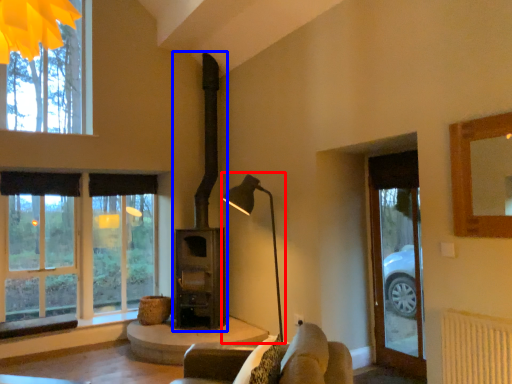
Question: Which object is closer to the camera taking this photo, table lamp (highlighted by a red box) or fireplace (highlighted by a blue box)?

Choices:
 (A) table lamp
 (B) fireplace

Answer: (A)